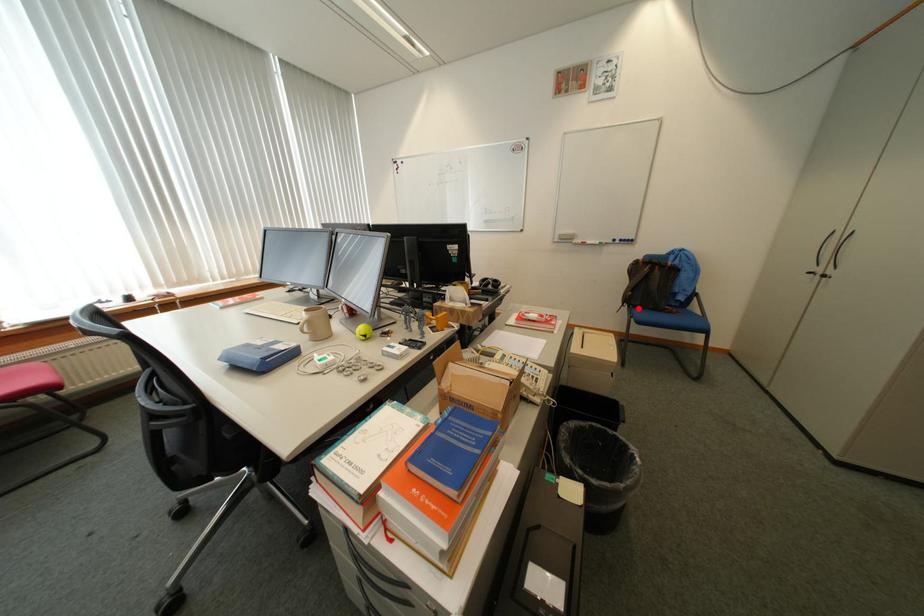
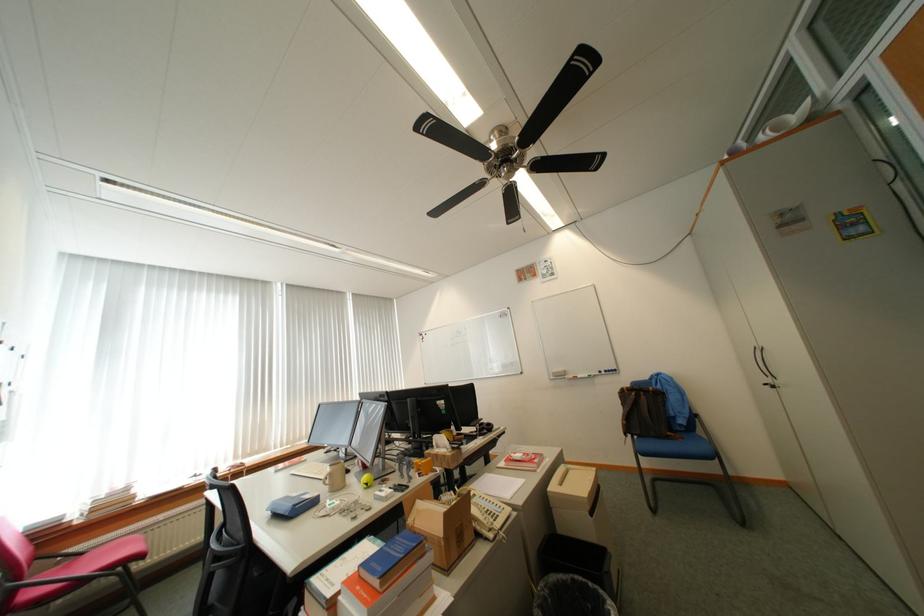
Where in the second image is the point corresponding to the highlighted location from the first image?

(641, 438)